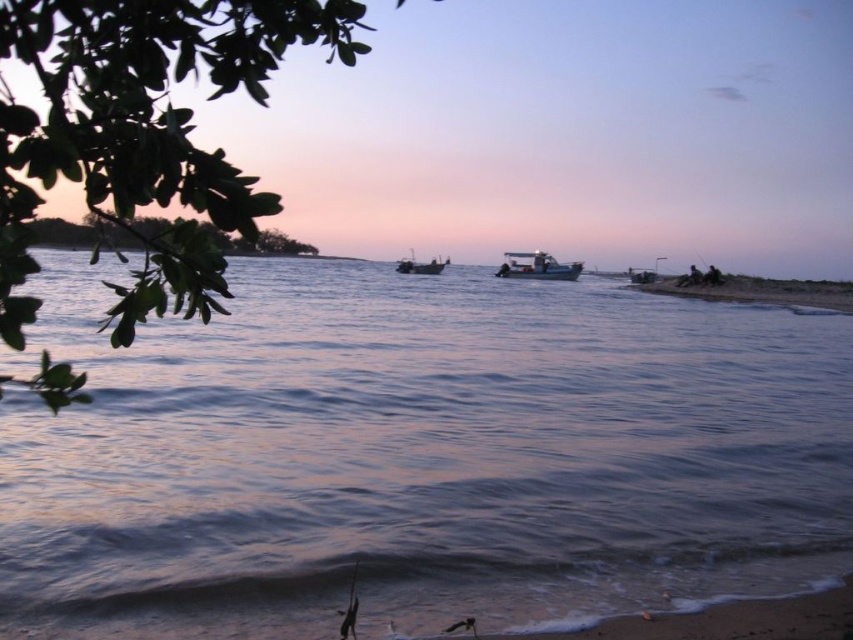
Between smooth water at center and white plastic boat at center, which one has less height?

white plastic boat at center

Is point (177, 600) less distant than point (531, 266)?

Yes, it is in front of point (531, 266).

Is point (657, 353) less distant than point (548, 260)?

Yes, point (657, 353) is in front of point (548, 260).

Locate an element on the screen. The height and width of the screenshot is (640, 853). smooth water at center is located at coordinates (418, 456).

Does white plastic boat at center appear over metallic gray boat at center?

Actually, white plastic boat at center is below metallic gray boat at center.

Can you confirm if white plastic boat at center is wider than metallic gray boat at center?

Correct, the width of white plastic boat at center exceeds that of metallic gray boat at center.

This screenshot has width=853, height=640. What are the coordinates of `white plastic boat at center` in the screenshot? It's located at (537, 266).

Image resolution: width=853 pixels, height=640 pixels. Find the location of `white plastic boat at center`. white plastic boat at center is located at coordinates (537, 266).

Is smooth water at center to the left of metallic gray boat at center from the viewer's perspective?

Indeed, smooth water at center is positioned on the left side of metallic gray boat at center.

Consider the image. Who is higher up, smooth water at center or metallic gray boat at center?

metallic gray boat at center

Does point (766, 352) lie in front of point (431, 268)?

That is True.

In order to click on smooth water at center in this screenshot , I will do [x=418, y=456].